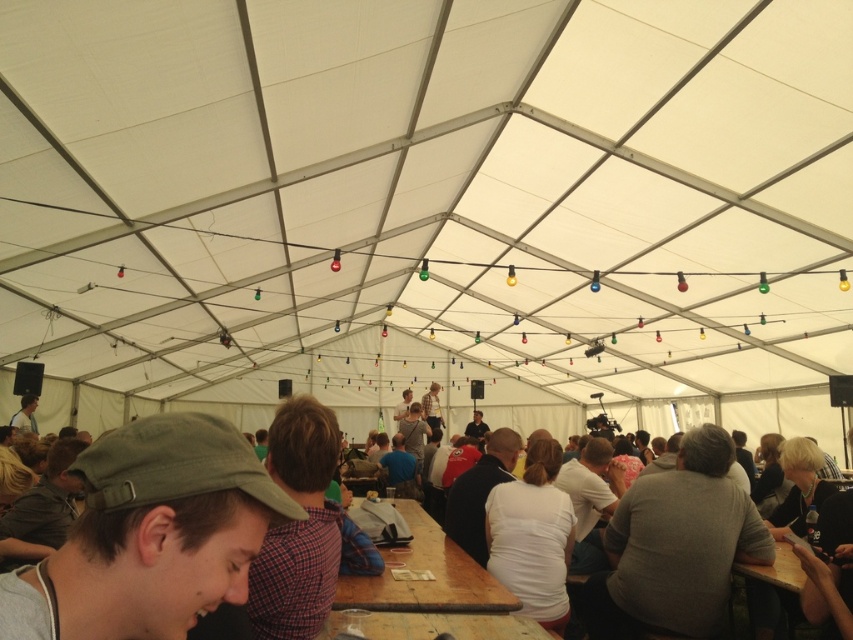
Is gray matte shirt at center positioned behind light brown wooden table at center?

Yes, gray matte shirt at center is further from the viewer.

Does gray matte shirt at center appear over light brown wooden table at center?

Yes, gray matte shirt at center is above light brown wooden table at center.

What do you see at coordinates (677, 545) in the screenshot?
I see `gray matte shirt at center` at bounding box center [677, 545].

At what (x,y) coordinates should I click in order to perform the action: click on gray matte shirt at center. Please return your answer as a coordinate pair (x, y). Looking at the image, I should click on (677, 545).

Is green fabric cap at lower left taller than wooden table at center?

In fact, green fabric cap at lower left may be shorter than wooden table at center.

In order to click on green fabric cap at lower left in this screenshot , I will do `click(149, 534)`.

Who is more forward, [440,547] or [387,618]?

Point [387,618]

Who is more distant from viewer, (1,412) or (349,624)?

The point (1,412) is more distant.

Where is `light brown wooden table at center`? light brown wooden table at center is located at coordinates (425, 596).